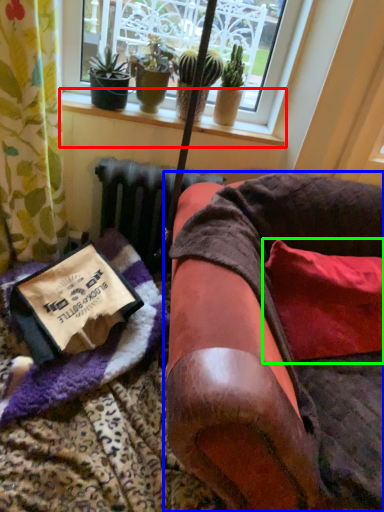
Question: Which object is the farthest from window sill (highlighted by a red box)? Choose among these: furniture (highlighted by a blue box) or pillow (highlighted by a green box).

Choices:
 (A) furniture
 (B) pillow

Answer: (A)